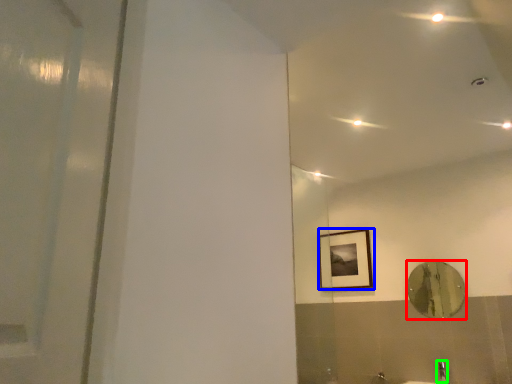
Question: Which object is the farthest from mirror (highlighted by a red box)? Choose among these: picture frame (highlighted by a blue box) or faucet (highlighted by a green box).

Choices:
 (A) picture frame
 (B) faucet

Answer: (A)